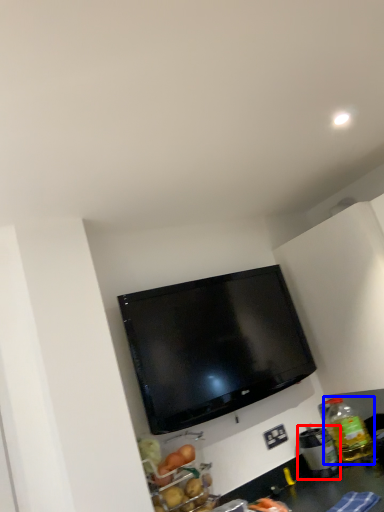
Question: Which object appears farthest to the camera in this image, appliance (highlighted by a red box) or bottle (highlighted by a blue box)?

Choices:
 (A) appliance
 (B) bottle

Answer: (B)